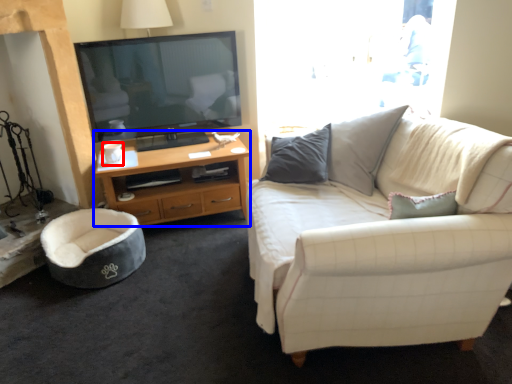
Question: Among these objects, which one is nearest to the camera, coffee cup (highlighted by a red box) or desk (highlighted by a blue box)?

Choices:
 (A) coffee cup
 (B) desk

Answer: (B)